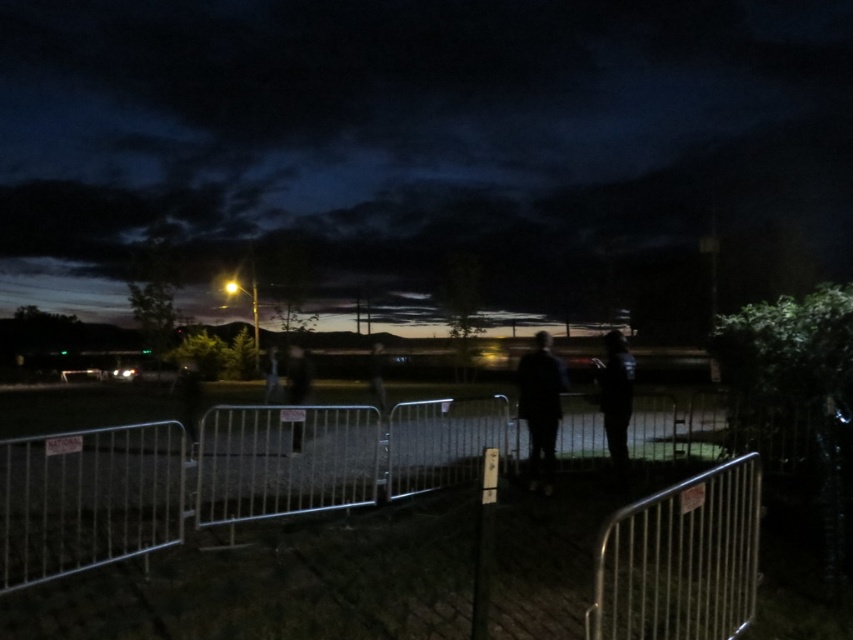
You are attending an outdoor event and notice a metallic silver barricade at center and a dark blue fabric jacket at center. Which object takes up more space in the scene?

The metallic silver barricade at center is larger in size than the dark blue fabric jacket at center, so the barricade occupies more space in the scene.

You are attending an outdoor event and notice a metallic silver barricade at center and a dark fabric jacket at center. Which object is closer to the ground?

The metallic silver barricade at center is closer to the ground because it is located below the dark fabric jacket at center.